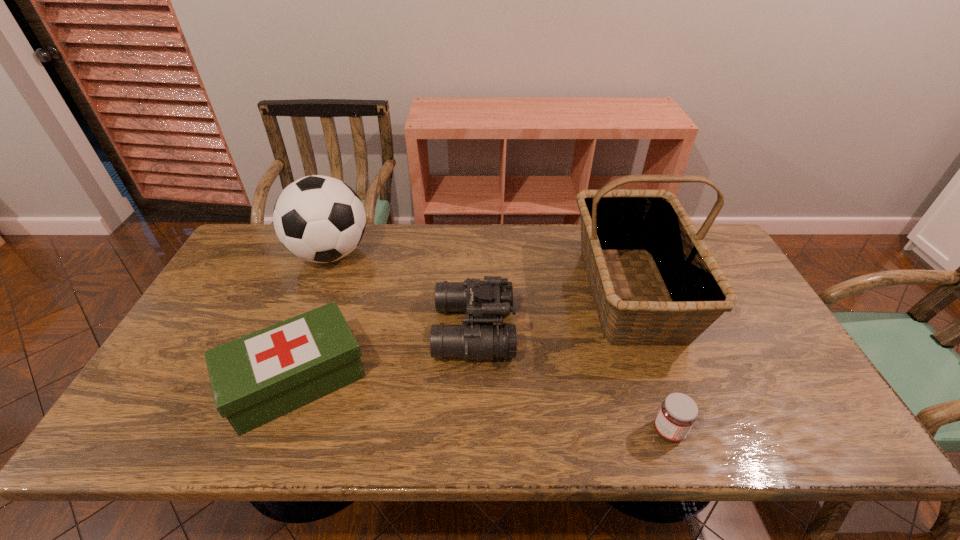
Where is `free area in between the third object from right to left and the soccer ball`? The image size is (960, 540). free area in between the third object from right to left and the soccer ball is located at coordinates (402, 292).

Where is `vacant area that lies between the third tallest object and the first-aid kit`? The width and height of the screenshot is (960, 540). vacant area that lies between the third tallest object and the first-aid kit is located at coordinates (385, 355).

Identify the location of vacant space that is in between the third shortest object and the first-aid kit. (385, 355).

You are a GUI agent. You are given a task and a screenshot of the screen. Output one action in this format:
    pyautogui.click(x=<x>, y=<y>)
    Task: Click on the vacant area that lies between the first-aid kit and the binoculars
    The image size is (960, 540).
    Given the screenshot: What is the action you would take?
    pyautogui.click(x=385, y=355)

Locate an element on the screen. free spot between the second shortest object and the jam is located at coordinates (483, 406).

In order to click on empty space between the shortest object and the second shortest object in this screenshot , I will do `click(483, 406)`.

Locate an element on the screen. the closest object to the soccer ball is located at coordinates (257, 378).

The height and width of the screenshot is (540, 960). Identify the location of object that can be found as the second closest to the fourth shortest object. (485, 301).

Where is `vacant space that satisfies the following two spatial constraints: 1. through the lenses of the jam; 2. on the left side of the third tallest object`? The width and height of the screenshot is (960, 540). vacant space that satisfies the following two spatial constraints: 1. through the lenses of the jam; 2. on the left side of the third tallest object is located at coordinates (472, 431).